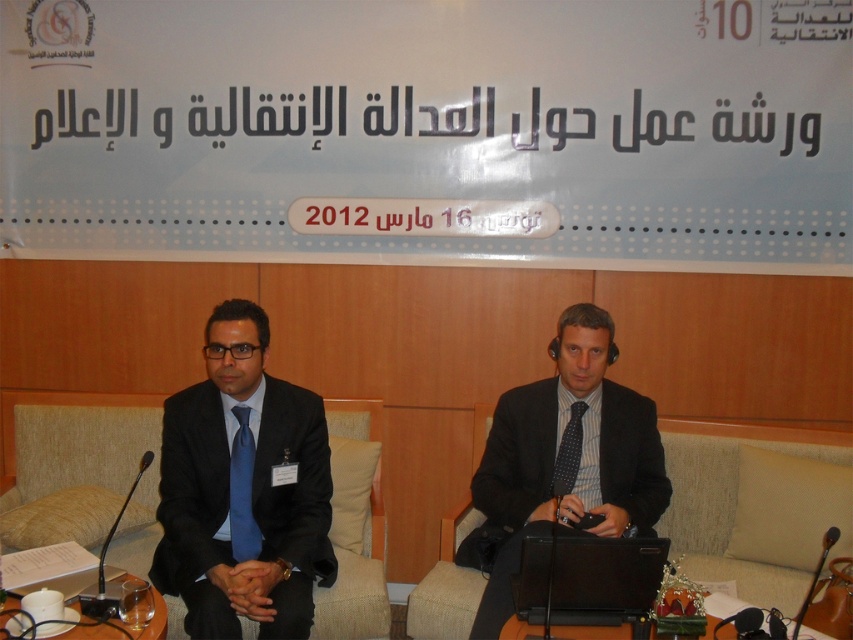
Question: Is the position of beige fabric couch at center less distant than that of polka dot silk tie at center?

Choices:
 (A) yes
 (B) no

Answer: (B)

Question: Which point is farther to the camera?

Choices:
 (A) (235, 467)
 (B) (689, 454)

Answer: (B)

Question: Can you confirm if beige fabric couch at center is positioned below translucent glass table at lower left?

Choices:
 (A) yes
 (B) no

Answer: (B)

Question: Can you confirm if beige fabric couch at center is thinner than blue silk tie at center?

Choices:
 (A) no
 (B) yes

Answer: (A)

Question: Which object is farther from the camera taking this photo?

Choices:
 (A) dark suit at center
 (B) black matte suit at left
 (C) polka dot silk tie at center
 (D) blue silk tie at center

Answer: (C)

Question: Which of these objects is positioned closest to the dark suit at center?

Choices:
 (A) blue silk tie at center
 (B) polka dot silk tie at center

Answer: (B)